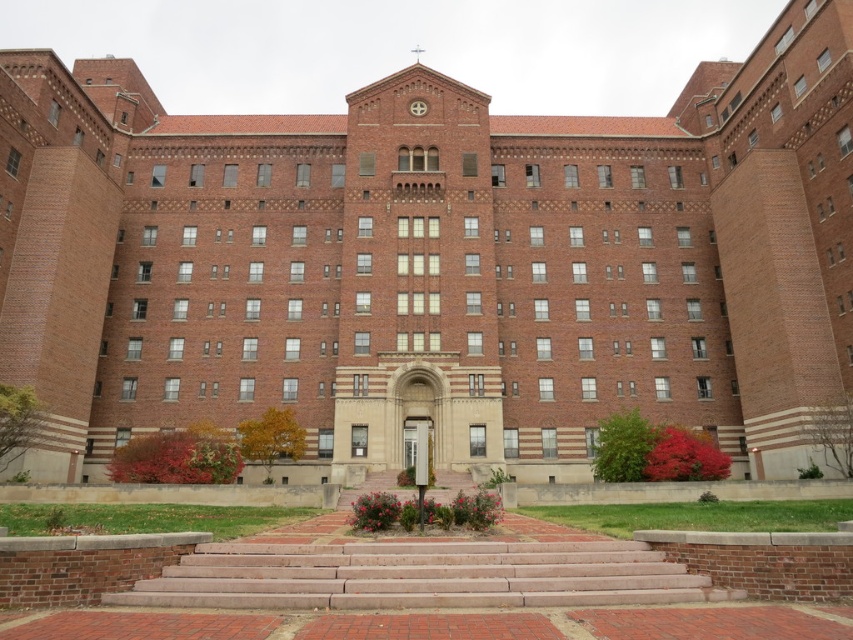
Can you confirm if brick stairs at center is positioned to the left of matte brick clock at center?

Incorrect, brick stairs at center is not on the left side of matte brick clock at center.

Who is positioned more to the left, brick stairs at center or matte brick clock at center?

Positioned to the left is matte brick clock at center.

Is point (595, 572) positioned after point (419, 106)?

No, it is not.

Locate an element on the screen. The image size is (853, 640). brick stairs at center is located at coordinates (421, 577).